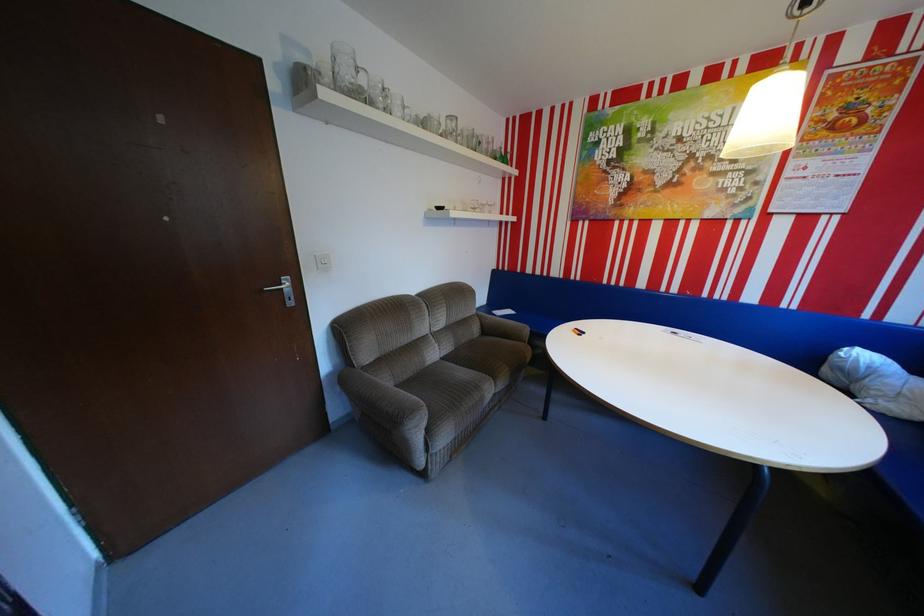
I want to click on sofa sitting surface, so click(492, 359).